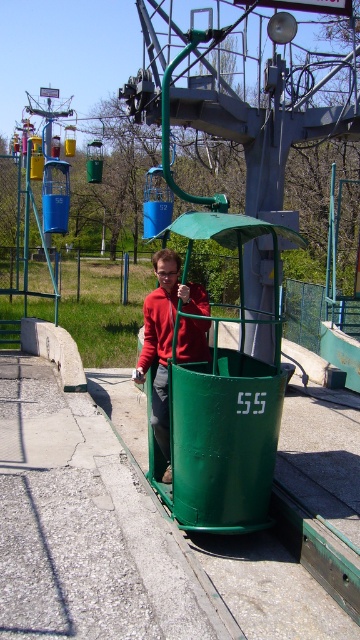
Question: Can you confirm if matte red sweater at center is wider than matte red jacket at center?

Choices:
 (A) no
 (B) yes

Answer: (B)

Question: Which point is closer to the camera?

Choices:
 (A) matte red sweater at center
 (B) matte red jacket at center

Answer: (A)

Question: Does matte red sweater at center appear on the left side of matte red jacket at center?

Choices:
 (A) no
 (B) yes

Answer: (B)

Question: Which of the following is the closest to the observer?

Choices:
 (A) (147, 332)
 (B) (149, 308)

Answer: (B)

Question: Is matte red sweater at center positioned in front of matte red jacket at center?

Choices:
 (A) yes
 (B) no

Answer: (A)